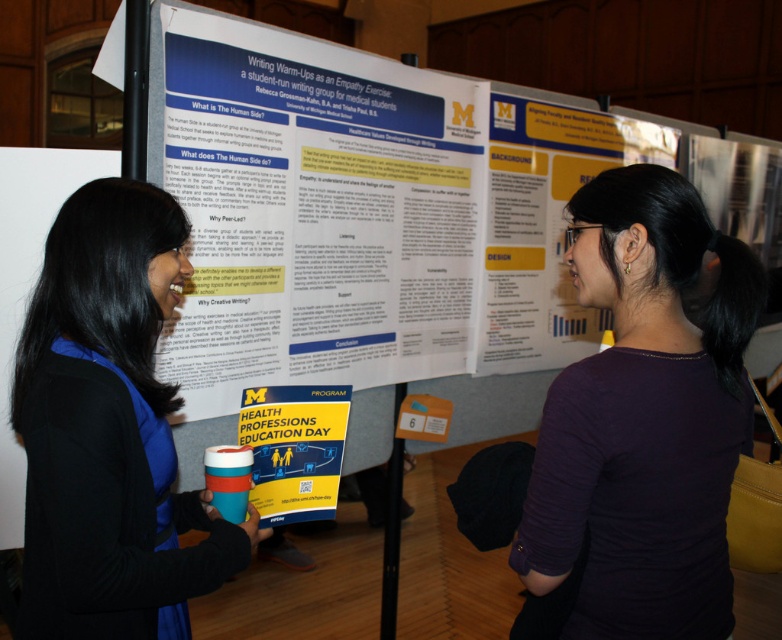
You are organizing a small event and need to place a 15 cm tall decoration on a table. You have the purple matte shirt at center and the yellow paper program at center in the image. Which object can you use as a base to ensure the decoration stands securely?

The purple matte shirt at center is taller than the yellow paper program at center, so the purple matte shirt at center can support the decoration as a base since it is taller and more stable.

You are organizing a small event and need to decide whether to place a name tag on the blue fabric shirt at left or the yellow paper program at center. Based on their sizes, which item can accommodate a wider name tag?

The blue fabric shirt at left is wider than the yellow paper program at center, so the name tag should be placed on the blue fabric shirt at left.

You are organizing a conference and need to place a name tag on the table between the purple matte shirt at center and the yellow paper program at center. Based on their positions, which object should the name tag be closer to?

The name tag should be placed closer to the yellow paper program at center because the purple matte shirt at center is to the right of the yellow paper program at center, meaning the yellow paper program is on the left side relative to the shirt. Therefore, the name tag should align with the program to maintain symmetry.